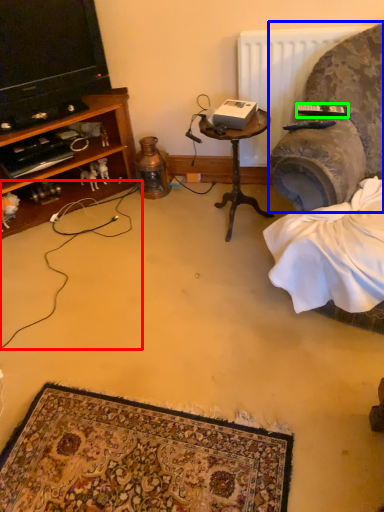
Question: Which object is the closest to the string (highlighted by a red box)? Choose among these: studio couch (highlighted by a blue box) or remote control (highlighted by a green box).

Choices:
 (A) studio couch
 (B) remote control

Answer: (A)